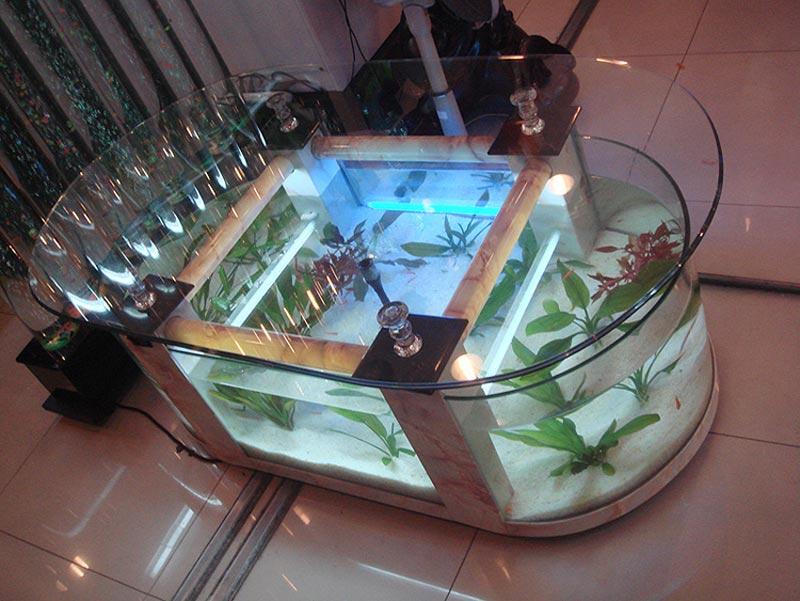
Where is `fish tank clear`? fish tank clear is located at coordinates (573, 475).